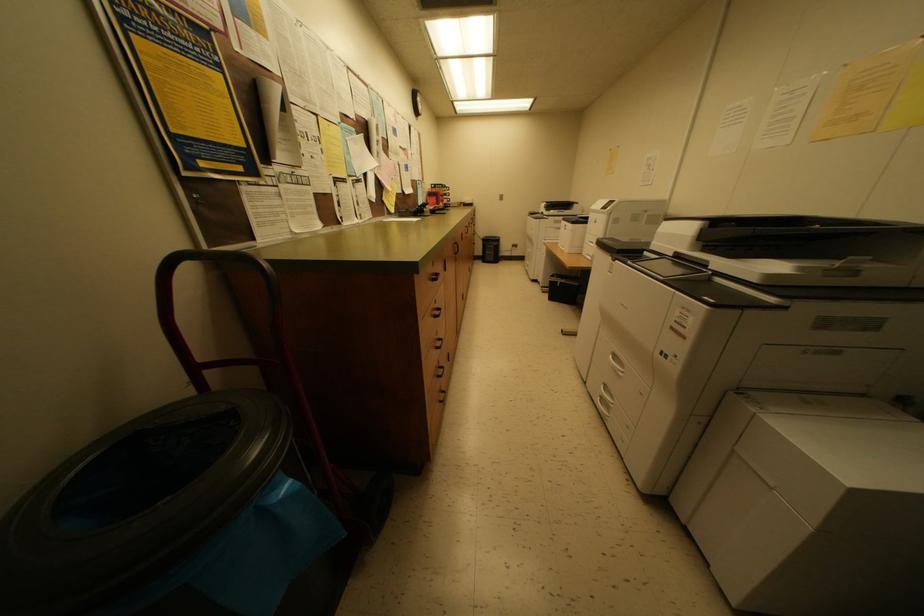
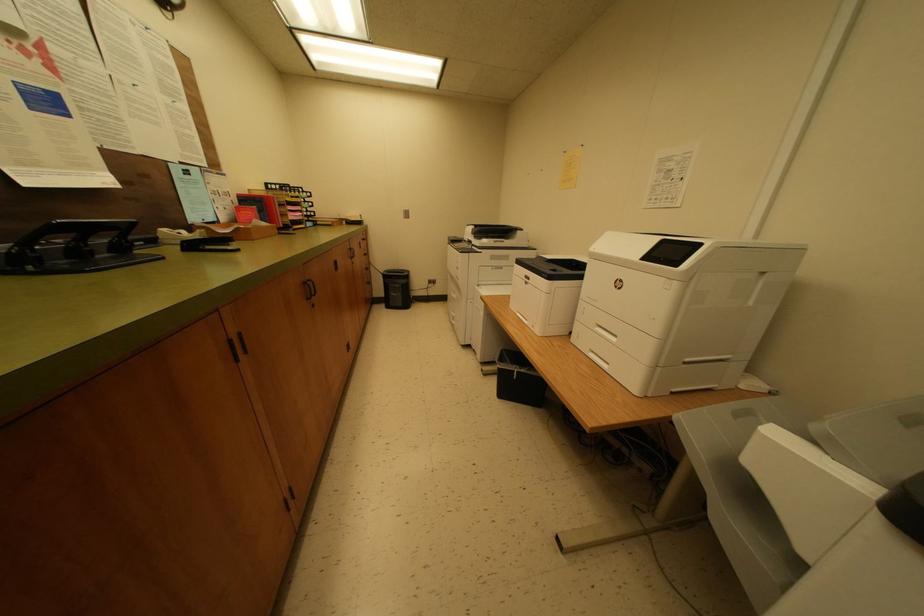
Question: The images are taken continuously from a first-person perspective. In which direction are you moving?

Choices:
 (A) Left
 (B) Right
 (C) Forward
 (D) Backward

Answer: (C)